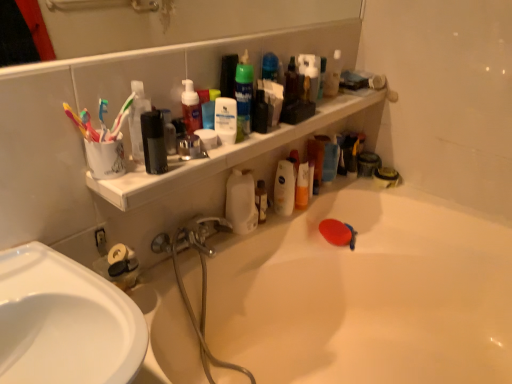
Image resolution: width=512 pixels, height=384 pixels. I want to click on space that is in front of matte red soap dispenser at upper center, which is the first cleaning product in front-to-back order, so click(x=176, y=165).